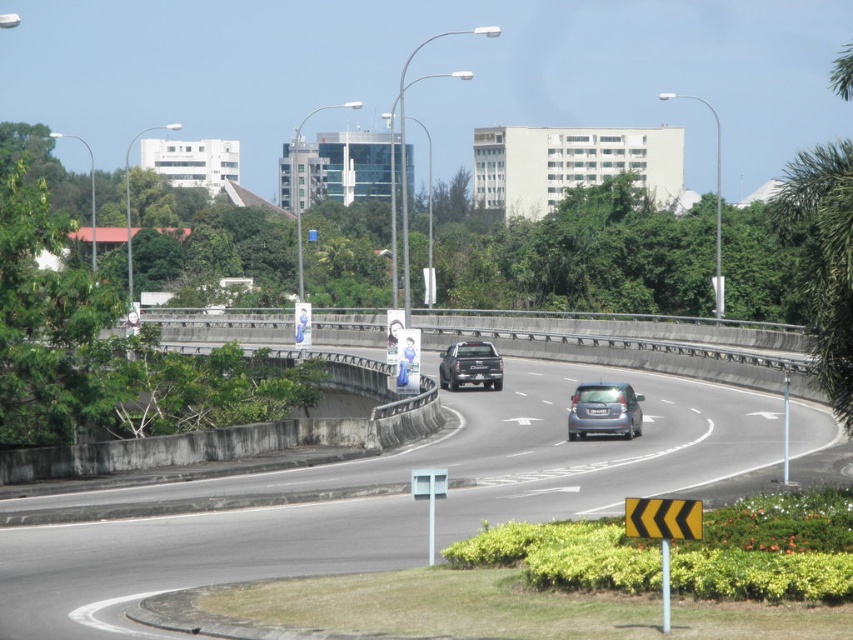
Question: Which point is closer to the camera?

Choices:
 (A) satin silver hatchback at center
 (B) matte black truck at center

Answer: (A)

Question: Can you confirm if satin silver hatchback at center is positioned above matte black truck at center?

Choices:
 (A) no
 (B) yes

Answer: (A)

Question: Which point is closer to the camera?

Choices:
 (A) (480, 349)
 (B) (288, 481)
 (C) (578, 408)

Answer: (B)

Question: Does satin silver hatchback at center appear under matte black truck at center?

Choices:
 (A) no
 (B) yes

Answer: (B)

Question: Is smooth asphalt road at center below satin silver hatchback at center?

Choices:
 (A) yes
 (B) no

Answer: (A)

Question: Which is farther from the satin silver hatchback at center?

Choices:
 (A) smooth asphalt road at center
 (B) matte black truck at center

Answer: (B)